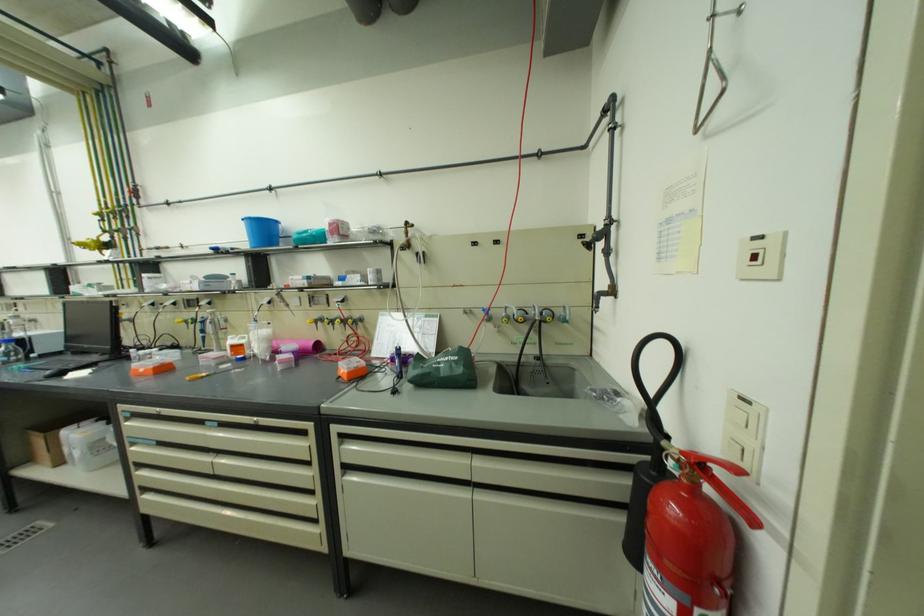
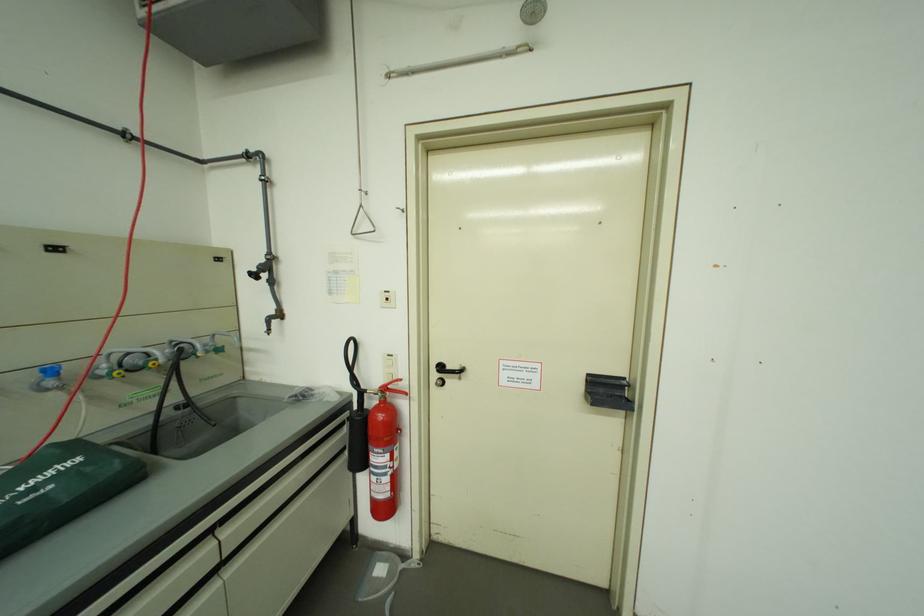
Locate, in the second image, the point that corresponds to point 495,313 in the first image.

(62, 373)